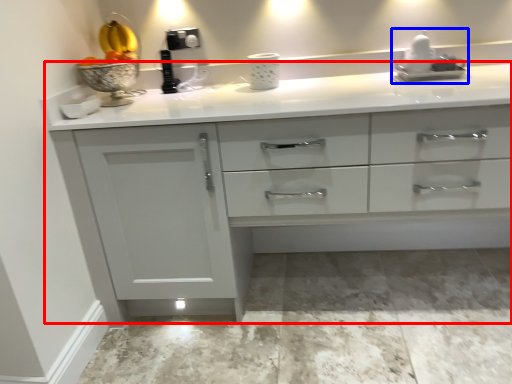
Question: Among these objects, which one is nearest to the camera, countertop (highlighted by a red box) or sink (highlighted by a blue box)?

Choices:
 (A) countertop
 (B) sink

Answer: (A)